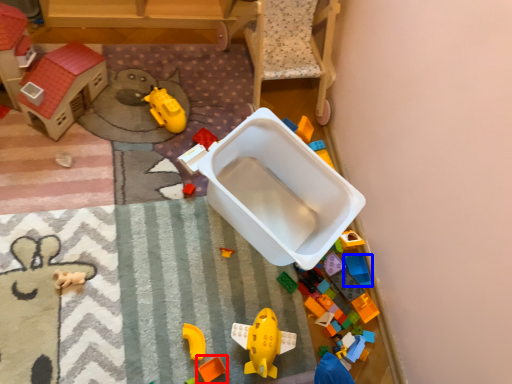
Question: Which of the following is the closest to the observer, toy (highlighted by a red box) or toy (highlighted by a blue box)?

Choices:
 (A) toy
 (B) toy

Answer: (A)